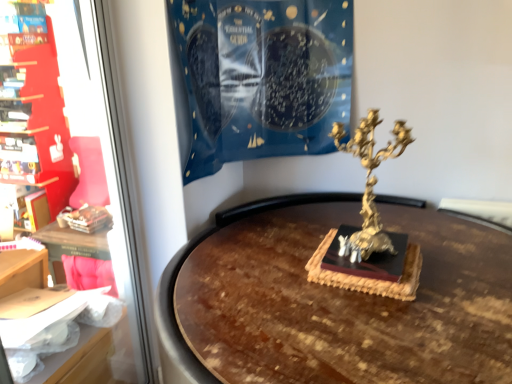
Question: Can you confirm if gold metallic candelabra at center-right is positioned to the left of matte red bookshelf at left?

Choices:
 (A) no
 (B) yes

Answer: (A)

Question: Is gold metallic candelabra at center-right not close to matte red bookshelf at left?

Choices:
 (A) no
 (B) yes

Answer: (B)

Question: Does gold metallic candelabra at center-right have a larger size compared to matte red bookshelf at left?

Choices:
 (A) yes
 (B) no

Answer: (B)

Question: From the image's perspective, is gold metallic candelabra at center-right on top of matte red bookshelf at left?

Choices:
 (A) no
 (B) yes

Answer: (B)

Question: From the image's perspective, is gold metallic candelabra at center-right beneath matte red bookshelf at left?

Choices:
 (A) no
 (B) yes

Answer: (A)

Question: Do you think matte red bookshelf at left is within black matte book at center, or outside of it?

Choices:
 (A) inside
 (B) outside

Answer: (B)

Question: Is matte red bookshelf at left bigger or smaller than black matte book at center?

Choices:
 (A) small
 (B) big

Answer: (B)

Question: From a real-world perspective, is matte red bookshelf at left above or below black matte book at center?

Choices:
 (A) below
 (B) above

Answer: (B)

Question: Is matte red bookshelf at left in front of or behind black matte book at center in the image?

Choices:
 (A) behind
 (B) front

Answer: (A)

Question: In terms of width, does black matte book at center look wider or thinner when compared to matte red bookshelf at left?

Choices:
 (A) thin
 (B) wide

Answer: (B)

Question: Considering the positions of black matte book at center and matte red bookshelf at left in the image, is black matte book at center bigger or smaller than matte red bookshelf at left?

Choices:
 (A) big
 (B) small

Answer: (B)

Question: Is point (348, 228) closer or farther from the camera than point (8, 170)?

Choices:
 (A) farther
 (B) closer

Answer: (B)

Question: From a real-world perspective, relative to matte red bookshelf at left, is black matte book at center vertically above or below?

Choices:
 (A) above
 (B) below

Answer: (B)

Question: Is matte red bookshelf at left to the left or to the right of matte red bookshelf at left in the image?

Choices:
 (A) right
 (B) left

Answer: (A)

Question: Does point (144, 357) appear closer or farther from the camera than point (45, 122)?

Choices:
 (A) closer
 (B) farther

Answer: (A)